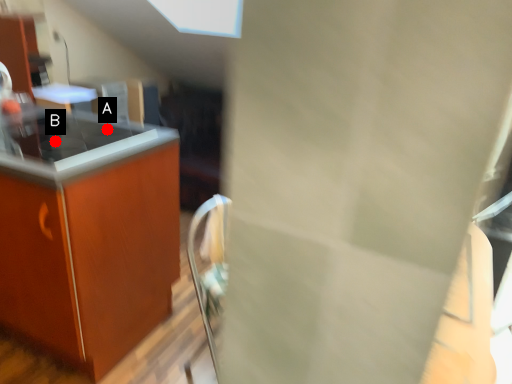
Question: Two points are circled on the image, labeled by A and B beside each circle. Which point is farther from the camera taking this photo?

Choices:
 (A) A is further
 (B) B is further

Answer: (A)